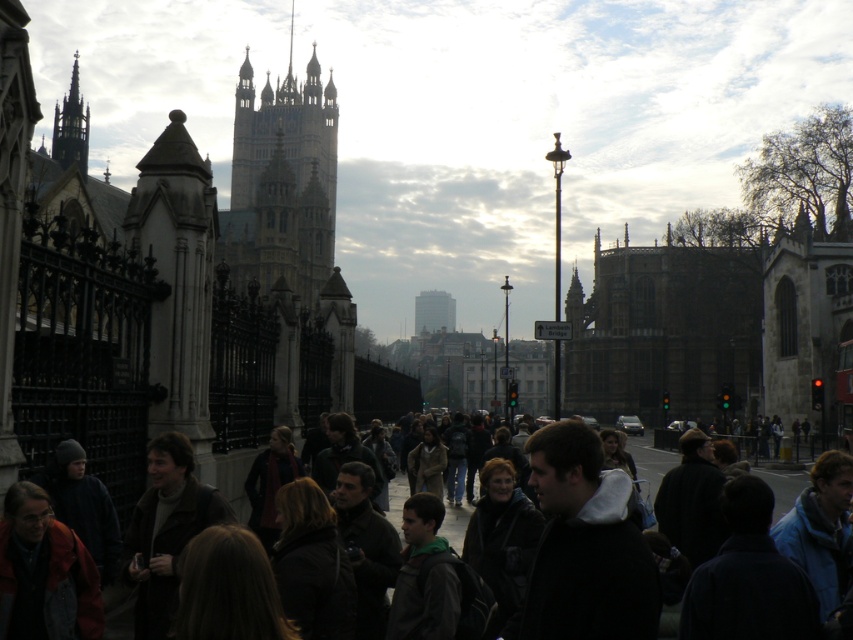
Question: Is dark brown leather jacket at center closer to the viewer compared to dark gray stone spire at upper left?

Choices:
 (A) no
 (B) yes

Answer: (B)

Question: Which point is farther to the camera?

Choices:
 (A) golden stone tower at upper center
 (B) dark gray stone spire at upper left

Answer: (B)

Question: Considering the real-world distances, which object is closest to the dark gray stone spire at upper left?

Choices:
 (A) dark brown leather jacket at center
 (B) golden stone tower at upper center

Answer: (B)

Question: Where is dark brown leather jacket at center located in relation to dark gray stone spire at upper left in the image?

Choices:
 (A) below
 (B) above

Answer: (A)

Question: Which object is farther from the camera taking this photo?

Choices:
 (A) dark gray stone spire at upper left
 (B) dark brown leather jacket at center

Answer: (A)

Question: Where is golden stone tower at upper center located in relation to dark gray stone spire at upper left in the image?

Choices:
 (A) below
 (B) above

Answer: (A)